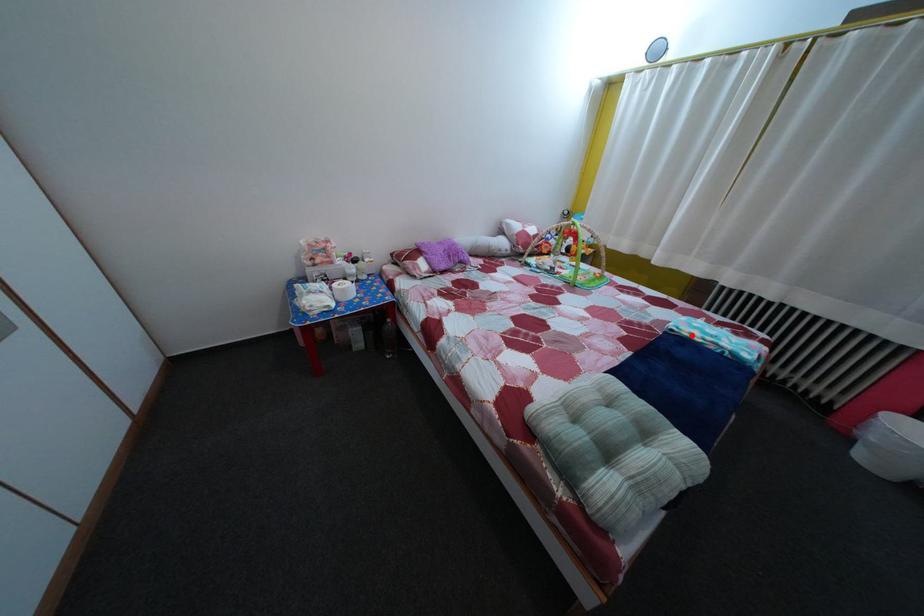
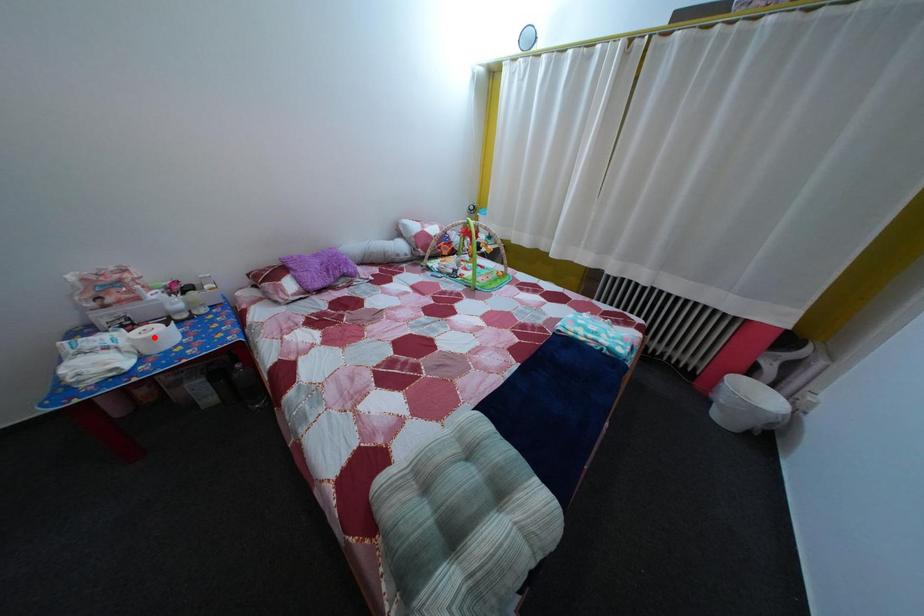
I am providing you with two images of the same scene from different viewpoints. A red point is marked on the first image and another point is marked on the second image. Is the marked point in image1 the same physical position as the marked point in image2?

No